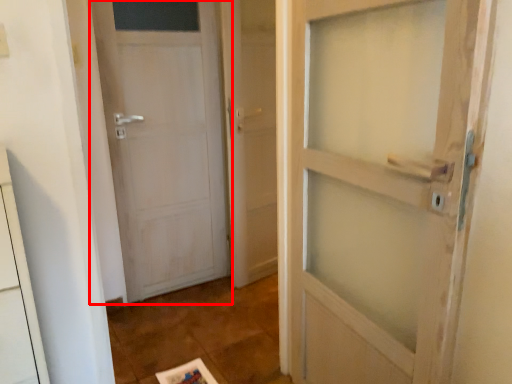
Question: From the image's perspective, what is the correct spatial positioning of door (annotated by the red box) in reference to screen door?

Choices:
 (A) above
 (B) below

Answer: (B)